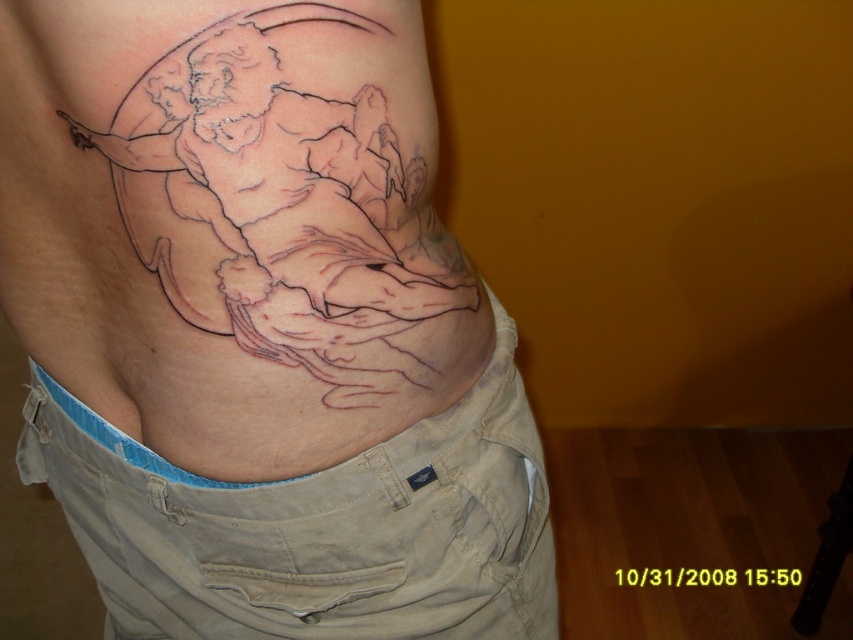
In the scene shown: Where is the black ink tattoo at upper center located in the image?

The black ink tattoo at upper center is located at point (260,326) in the image.

Based on the photo, you are a tattoo artist working on a client. The client wants to know if the point at coordinates (236,460) on their tattoo is within the visible area of the camera. The camera has a field of view that can capture up to 20 inches. Can you confirm if the point is within the camera view?

The point at coordinates (236,460) is 20.21 inches away from the camera. Since the camera can only capture up to 20 inches, the point is slightly out of the camera view.